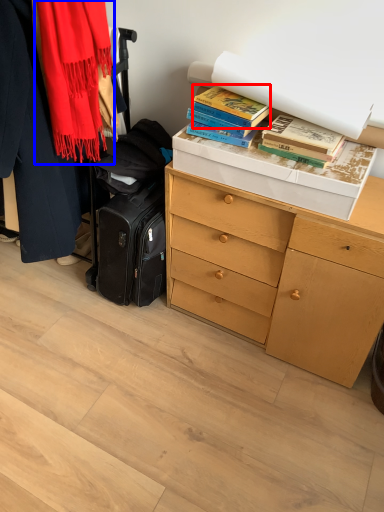
Question: Which object appears farthest to the camera in this image, book (highlighted by a red box) or scarf (highlighted by a blue box)?

Choices:
 (A) book
 (B) scarf

Answer: (A)